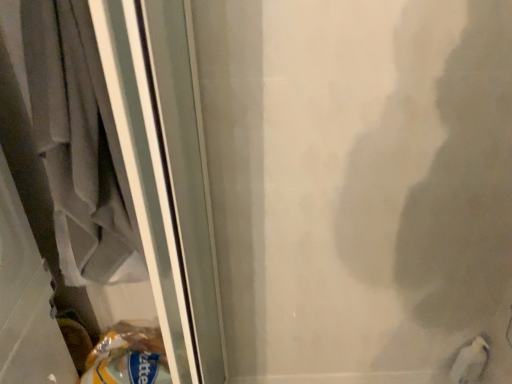
Question: From the image's perspective, does white matte bird at lower right appear lower than gray fabric laundry at left?

Choices:
 (A) yes
 (B) no

Answer: (A)

Question: Is white matte bird at lower right next to gray fabric laundry at left?

Choices:
 (A) yes
 (B) no

Answer: (B)

Question: Is the position of white matte bird at lower right less distant than that of gray fabric laundry at left?

Choices:
 (A) yes
 (B) no

Answer: (B)

Question: Does white matte bird at lower right have a lesser width compared to gray fabric laundry at left?

Choices:
 (A) yes
 (B) no

Answer: (A)

Question: Can we say white matte bird at lower right lies outside gray fabric laundry at left?

Choices:
 (A) yes
 (B) no

Answer: (A)

Question: Could you tell me if white matte bird at lower right is facing gray fabric laundry at left?

Choices:
 (A) no
 (B) yes

Answer: (A)

Question: Is gray fabric laundry at left completely or partially outside of white matte bird at lower right?

Choices:
 (A) no
 (B) yes

Answer: (B)

Question: From a real-world perspective, is gray fabric laundry at left beneath white matte bird at lower right?

Choices:
 (A) yes
 (B) no

Answer: (B)

Question: Is gray fabric laundry at left not near white matte bird at lower right?

Choices:
 (A) no
 (B) yes

Answer: (B)

Question: Considering the relative positions of gray fabric laundry at left and white matte bird at lower right in the image provided, is gray fabric laundry at left to the left of white matte bird at lower right from the viewer's perspective?

Choices:
 (A) no
 (B) yes

Answer: (B)

Question: From the image's perspective, is gray fabric laundry at left beneath white matte bird at lower right?

Choices:
 (A) yes
 (B) no

Answer: (B)

Question: Does gray fabric laundry at left have a greater height compared to white matte bird at lower right?

Choices:
 (A) yes
 (B) no

Answer: (A)

Question: From a real-world perspective, relative to white matte bird at lower right, is gray fabric laundry at left vertically above or below?

Choices:
 (A) below
 (B) above

Answer: (B)